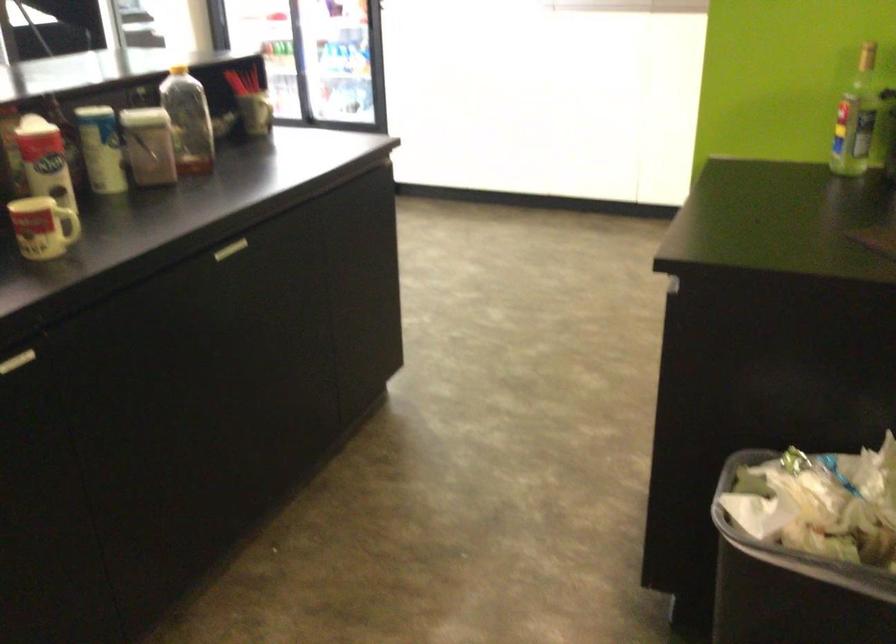
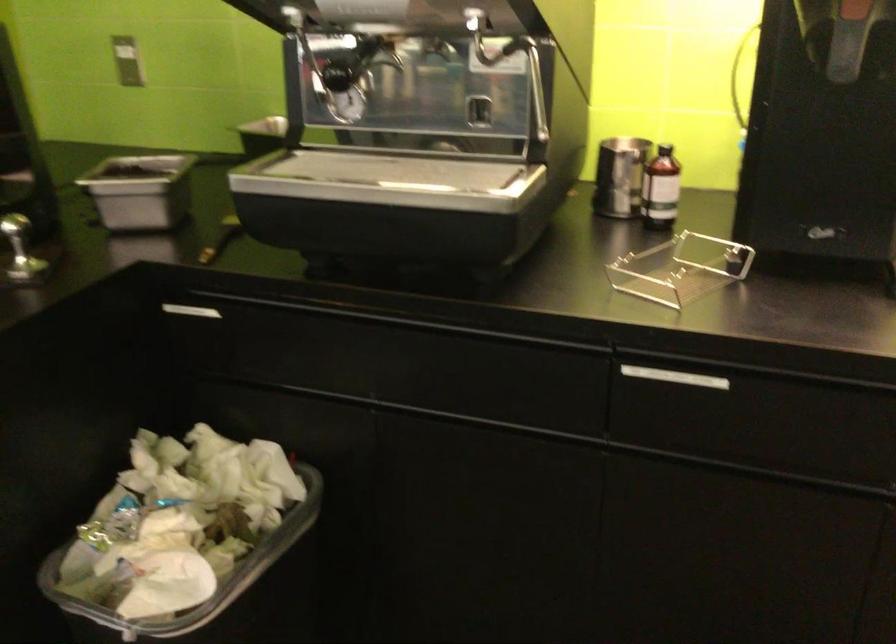
Locate, in the second image, the point that corresponds to the point at 779,545 in the first image.

(218, 592)